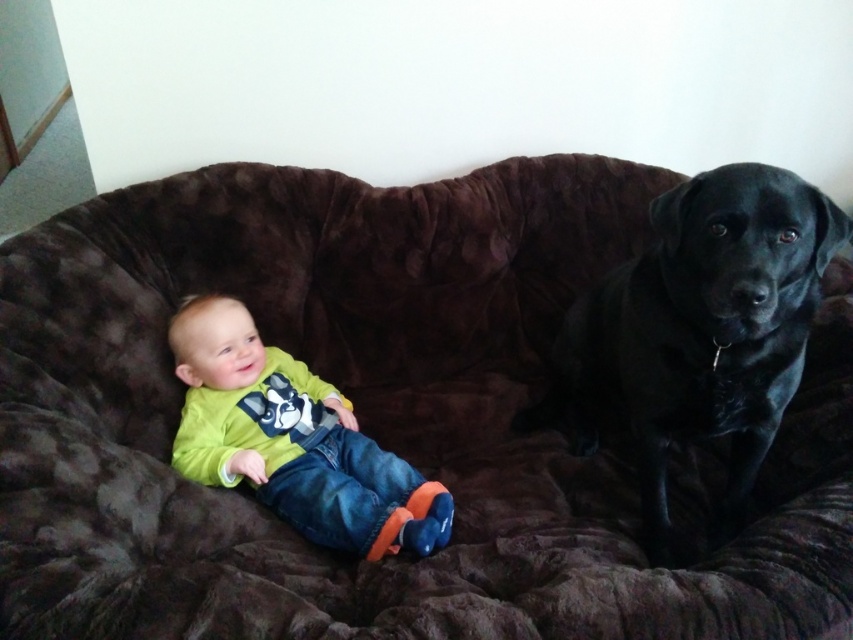
You are a photographer setting up a shoot in the living room. You need to position a camera to capture both the black velvet dog at right and the lime green jersey at center. Based on their positions, which object is higher in the image?

The black velvet dog at right is positioned above the lime green jersey at center, so it will appear higher in the image.

You are a photographer trying to capture a closeup of the black velvet dog at right. The camera you are using has a focal length of 50mm and is positioned 2 meters away from the couch. Given the coordinates of the dog at point 0.517, 0.819, can you determine if the dog will be in the center of the frame?

The black velvet dog at right is positioned at coordinates (698,330), which is slightly to the right and lower than the exact center of the frame. Therefore, the dog will not be perfectly centered in the photo.